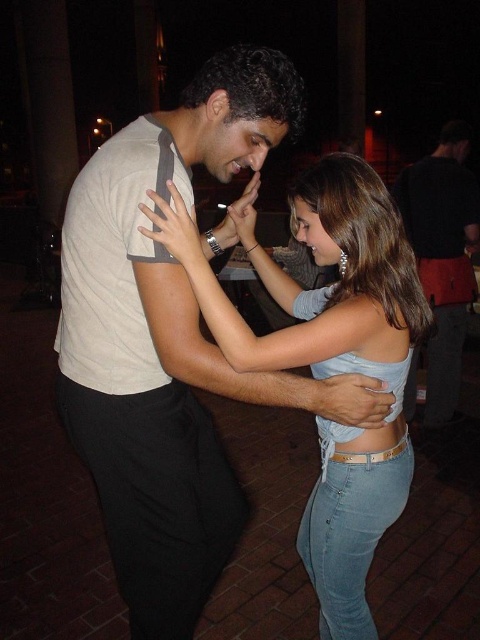
Question: Which object appears farthest from the camera in this image?

Choices:
 (A) light beige t-shirt at center
 (B) light blue denim jeans at center
 (C) matte black shirt at center

Answer: (C)

Question: Is light blue denim jeans at center smaller than matte black shirt at center?

Choices:
 (A) no
 (B) yes

Answer: (B)

Question: Is light beige t-shirt at center further to camera compared to matte black shirt at center?

Choices:
 (A) yes
 (B) no

Answer: (B)

Question: Is light beige t-shirt at center below matte black shirt at center?

Choices:
 (A) yes
 (B) no

Answer: (A)

Question: Which object is positioned farthest from the light beige t-shirt at center?

Choices:
 (A) matte black shirt at center
 (B) light blue denim jeans at center

Answer: (A)

Question: Estimate the real-world distances between objects in this image. Which object is closer to the light beige t-shirt at center?

Choices:
 (A) matte black shirt at center
 (B) light blue denim jeans at center

Answer: (B)